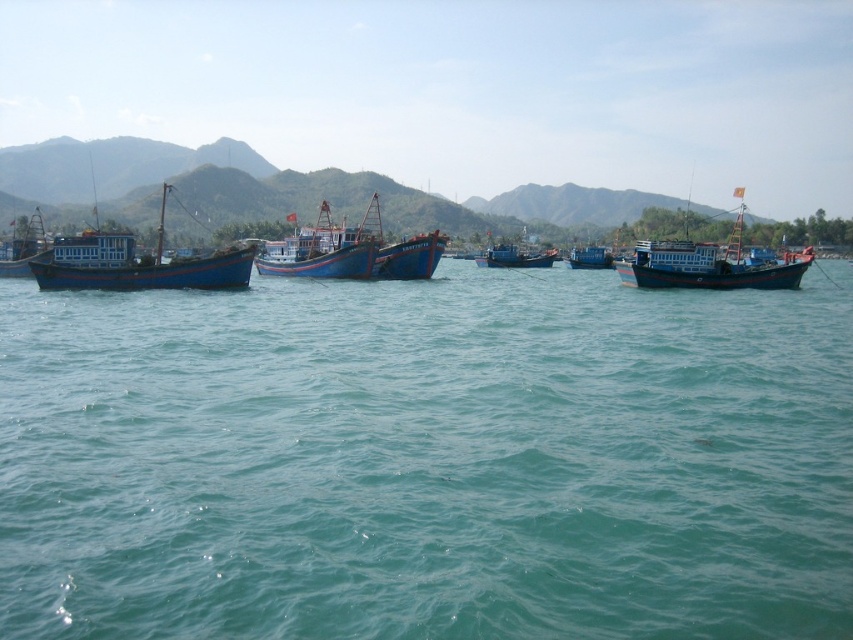
You are a sailor planning to navigate your boat through the channel between the green textured mountain at upper left and the blue wooden boat at left. Which direction should you steer your boat to avoid the mountain?

The green textured mountain at upper left is positioned on the right side of blue wooden boat at left. To avoid the mountain, steer your boat to the left side of the blue wooden boat at left.

You are a photographer who wants to capture the green textured mountain at upper left in your shot. Based on the coordinates provided, which direction should you aim your camera to include it in your frame?

The green textured mountain at upper left is located at coordinates point (285, 186), so you should aim your camera towards the upper left direction to capture it in your shot.

You are standing on the beach and looking out at the coastal scene. Which object, the green textured mountain at upper left or the blue painted wooden boat at left, is positioned higher in your field of view?

The green textured mountain at upper left is positioned higher in your field of view because it is located above the blue painted wooden boat at left.